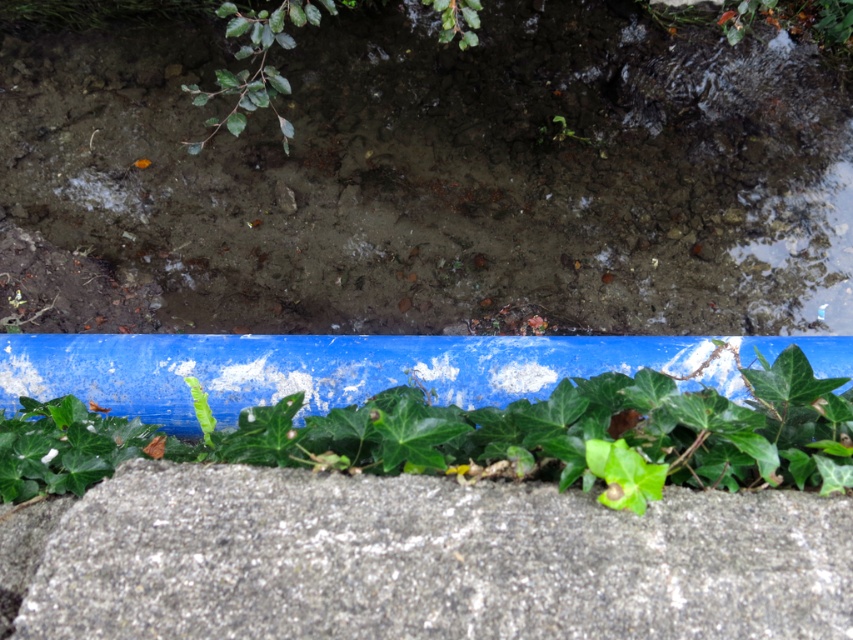
Question: Can you confirm if translucent mud puddle at upper center is smaller than green leafy plant at bottom?

Choices:
 (A) yes
 (B) no

Answer: (B)

Question: Which is nearer to the gray rough concrete at bottom?

Choices:
 (A) translucent mud puddle at upper center
 (B) green leafy plant at bottom

Answer: (B)

Question: Estimate the real-world distances between objects in this image. Which object is farther from the gray rough concrete at bottom?

Choices:
 (A) translucent mud puddle at upper center
 (B) green leafy plant at bottom

Answer: (A)

Question: Which point is farther to the camera?

Choices:
 (A) translucent mud puddle at upper center
 (B) green leafy plant at bottom
 (C) gray rough concrete at bottom

Answer: (A)

Question: Does translucent mud puddle at upper center appear on the right side of gray rough concrete at bottom?

Choices:
 (A) yes
 (B) no

Answer: (A)

Question: Does translucent mud puddle at upper center have a lesser width compared to green leafy plant at bottom?

Choices:
 (A) yes
 (B) no

Answer: (B)